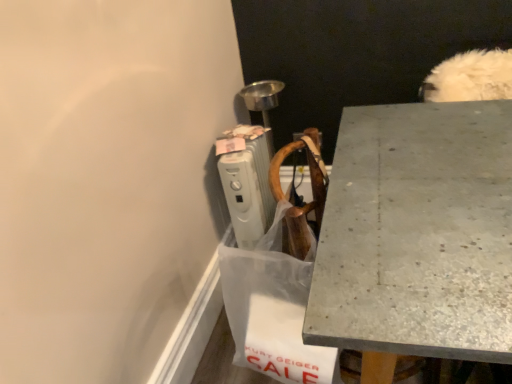
In order to face white plastic radiator at upper center, should I rotate leftwards or rightwards?

You should rotate left by 1.133 degrees.

Locate an element on the screen. The width and height of the screenshot is (512, 384). white plastic radiator at upper center is located at coordinates pyautogui.click(x=247, y=181).

Considering the relative positions of granite gray desk at upper right and transparent plastic shopping bag at lower center in the image provided, is granite gray desk at upper right to the left of transparent plastic shopping bag at lower center from the viewer's perspective?

No.

Could transparent plastic shopping bag at lower center be considered to be inside granite gray desk at upper right?

No.

Are granite gray desk at upper right and transparent plastic shopping bag at lower center beside each other?

No, granite gray desk at upper right is not making contact with transparent plastic shopping bag at lower center.

Based on the photo, how different are the orientations of granite gray desk at upper right and transparent plastic shopping bag at lower center in degrees?

2.07 degrees separate the facing orientations of granite gray desk at upper right and transparent plastic shopping bag at lower center.

From the image's perspective, is transparent plastic shopping bag at lower center positioned above or below white plastic radiator at upper center?

transparent plastic shopping bag at lower center is below white plastic radiator at upper center.

Is transparent plastic shopping bag at lower center aimed at white plastic radiator at upper center?

No, transparent plastic shopping bag at lower center is not turned towards white plastic radiator at upper center.

How many degrees apart are the facing directions of transparent plastic shopping bag at lower center and white plastic radiator at upper center?

The angular difference between transparent plastic shopping bag at lower center and white plastic radiator at upper center is 91.3 degrees.

Which of these two, transparent plastic shopping bag at lower center or white plastic radiator at upper center, is thinner?

transparent plastic shopping bag at lower center is thinner.

The image size is (512, 384). In order to click on shopping bag that is behind the granite gray desk at upper right in this screenshot , I will do (273, 309).

Could you tell me if transparent plastic shopping bag at lower center is turned towards granite gray desk at upper right?

No, transparent plastic shopping bag at lower center does not turn towards granite gray desk at upper right.

Which is more to the left, transparent plastic shopping bag at lower center or granite gray desk at upper right?

From the viewer's perspective, transparent plastic shopping bag at lower center appears more on the left side.

Is transparent plastic shopping bag at lower center not within granite gray desk at upper right?

Absolutely, transparent plastic shopping bag at lower center is external to granite gray desk at upper right.

Considering the sizes of objects granite gray desk at upper right and white plastic radiator at upper center in the image provided, who is wider, granite gray desk at upper right or white plastic radiator at upper center?

Wider between the two is granite gray desk at upper right.

Is granite gray desk at upper right situated inside white plastic radiator at upper center or outside?

The correct answer is: outside.

Considering the sizes of objects granite gray desk at upper right and white plastic radiator at upper center in the image provided, who is taller, granite gray desk at upper right or white plastic radiator at upper center?

granite gray desk at upper right is taller.

Is granite gray desk at upper right to the right of white plastic radiator at upper center from the viewer's perspective?

Yes.

From the picture: From a real-world perspective, is white plastic radiator at upper center physically located above or below transparent plastic shopping bag at lower center?

From a real-world perspective, white plastic radiator at upper center is physically below transparent plastic shopping bag at lower center.

Is white plastic radiator at upper center situated inside transparent plastic shopping bag at lower center or outside?

white plastic radiator at upper center is not enclosed by transparent plastic shopping bag at lower center.

From the image's perspective, between white plastic radiator at upper center and transparent plastic shopping bag at lower center, who is located below?

transparent plastic shopping bag at lower center appears lower in the image.

Is white plastic radiator at upper center not near granite gray desk at upper right?

No, white plastic radiator at upper center is not far from granite gray desk at upper right.

Is point (230, 164) positioned before point (343, 113)?

No, (230, 164) is behind (343, 113).

From the image's perspective, which is below, white plastic radiator at upper center or granite gray desk at upper right?

granite gray desk at upper right is shown below in the image.

Between white plastic radiator at upper center and granite gray desk at upper right, which one has less height?

white plastic radiator at upper center.

The width and height of the screenshot is (512, 384). I want to click on shopping bag on the left of granite gray desk at upper right, so click(273, 309).

I want to click on radiator lying behind the transparent plastic shopping bag at lower center, so click(x=247, y=181).

Looking at the image, which one is located further to transparent plastic shopping bag at lower center, granite gray desk at upper right or white plastic radiator at upper center?

white plastic radiator at upper center is positioned further to the anchor transparent plastic shopping bag at lower center.

In the scene shown: Based on their spatial positions, is granite gray desk at upper right or transparent plastic shopping bag at lower center closer to white plastic radiator at upper center?

transparent plastic shopping bag at lower center is closer to white plastic radiator at upper center.

From the image, which object appears to be farther from transparent plastic shopping bag at lower center, white plastic radiator at upper center or granite gray desk at upper right?

Among the two, white plastic radiator at upper center is located further to transparent plastic shopping bag at lower center.

Considering their positions, is transparent plastic shopping bag at lower center positioned further to granite gray desk at upper right than white plastic radiator at upper center?

The object further to granite gray desk at upper right is white plastic radiator at upper center.

Consider the image. When comparing their distances from white plastic radiator at upper center, does transparent plastic shopping bag at lower center or granite gray desk at upper right seem closer?

Based on the image, transparent plastic shopping bag at lower center appears to be nearer to white plastic radiator at upper center.

Considering their positions, is white plastic radiator at upper center positioned closer to granite gray desk at upper right than transparent plastic shopping bag at lower center?

Among the two, transparent plastic shopping bag at lower center is located nearer to granite gray desk at upper right.

Find the location of a particular element. The width and height of the screenshot is (512, 384). shopping bag between granite gray desk at upper right and white plastic radiator at upper center in the front-back direction is located at coordinates (273, 309).